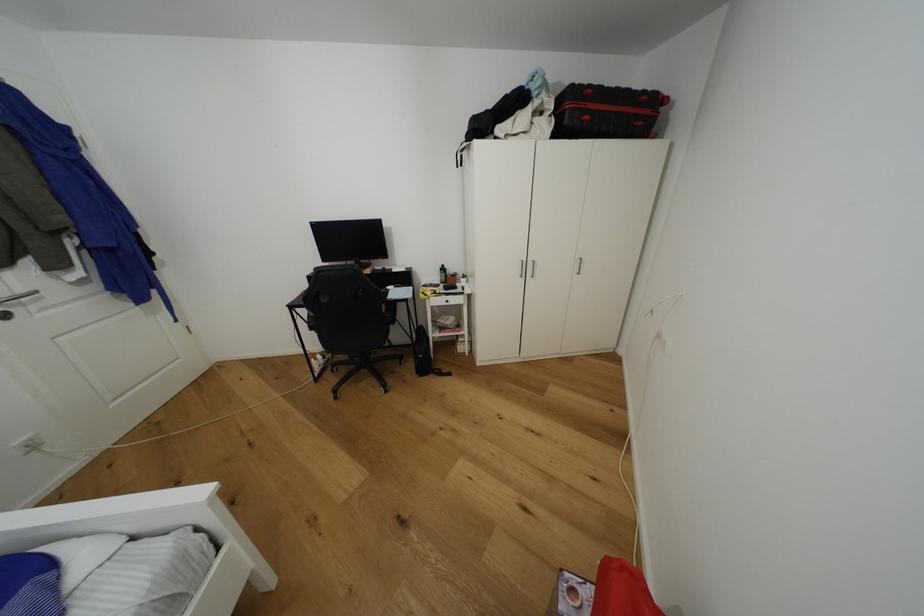
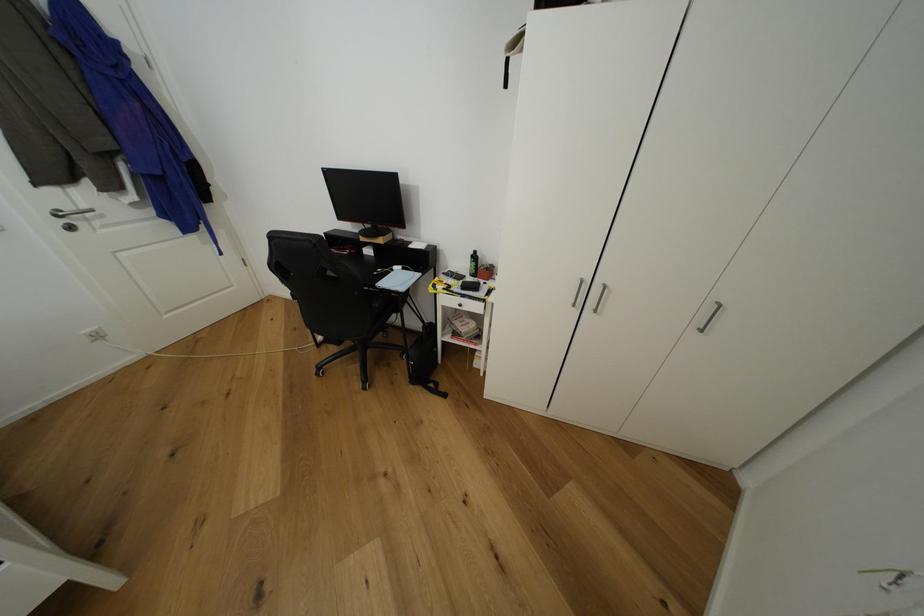
In the second image, find the point that corresponds to pixel 446 270 in the first image.

(478, 257)